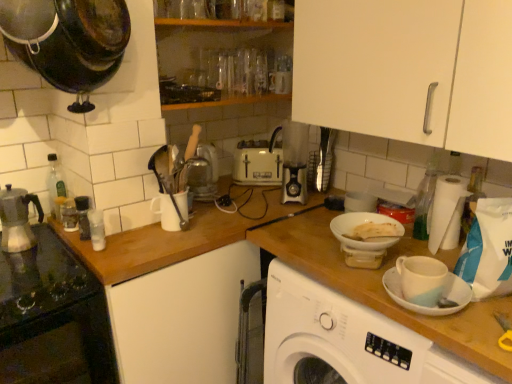
Question: Is clear plastic bottle at right, the 1th bottle from the right, in front of wooden at left?

Choices:
 (A) yes
 (B) no

Answer: (B)

Question: Can you confirm if clear plastic bottle at right, the 1th bottle from the right, is positioned to the left of wooden at left?

Choices:
 (A) yes
 (B) no

Answer: (B)

Question: Is clear plastic bottle at right, the 1th bottle from the right, directly adjacent to wooden at left?

Choices:
 (A) yes
 (B) no

Answer: (B)

Question: Can you confirm if clear plastic bottle at right, the 1th bottle from the right, is wider than wooden at left?

Choices:
 (A) yes
 (B) no

Answer: (B)

Question: Is clear plastic bottle at right, the 1th bottle from the right, thinner than wooden at left?

Choices:
 (A) no
 (B) yes

Answer: (B)

Question: Looking at their shapes, would you say black plastic grinder at left, placed as the 3th bottle when sorted from right to left, is wider or thinner than clear glass bottle at left, arranged as the 4th bottle when viewed from the right?

Choices:
 (A) wide
 (B) thin

Answer: (B)

Question: Is black plastic grinder at left, placed as the 3th bottle when sorted from right to left, in front of or behind clear glass bottle at left, which is counted as the first bottle, starting from the left, in the image?

Choices:
 (A) behind
 (B) front

Answer: (B)

Question: Considering the positions of black plastic grinder at left, positioned as the 2th bottle in left-to-right order, and clear glass bottle at left, which is counted as the first bottle, starting from the left, in the image, is black plastic grinder at left, positioned as the 2th bottle in left-to-right order, taller or shorter than clear glass bottle at left, which is counted as the first bottle, starting from the left,?

Choices:
 (A) tall
 (B) short

Answer: (B)

Question: From the image's perspective, is black plastic grinder at left, placed as the 3th bottle when sorted from right to left, above or below clear glass bottle at left, arranged as the 4th bottle when viewed from the right?

Choices:
 (A) above
 (B) below

Answer: (B)

Question: From a real-world perspective, relative to black plastic grinder at left, placed as the 3th bottle when sorted from right to left, is white matte cabinet at upper right vertically above or below?

Choices:
 (A) below
 (B) above

Answer: (B)

Question: Considering the positions of white matte cabinet at upper right and black plastic grinder at left, placed as the 3th bottle when sorted from right to left, in the image, is white matte cabinet at upper right bigger or smaller than black plastic grinder at left, placed as the 3th bottle when sorted from right to left,?

Choices:
 (A) small
 (B) big

Answer: (B)

Question: In the image, is white matte cabinet at upper right positioned in front of or behind black plastic grinder at left, positioned as the 2th bottle in left-to-right order?

Choices:
 (A) behind
 (B) front

Answer: (B)

Question: Visually, is white matte cabinet at upper right positioned to the left or to the right of black plastic grinder at left, positioned as the 2th bottle in left-to-right order?

Choices:
 (A) right
 (B) left

Answer: (A)

Question: From a real-world perspective, is black glass cooktop at left physically located above or below clear plastic bottle at right, which is the fourth bottle in left-to-right order?

Choices:
 (A) above
 (B) below

Answer: (B)

Question: Is black glass cooktop at left to the left or to the right of clear plastic bottle at right, the 1th bottle from the right, in the image?

Choices:
 (A) right
 (B) left

Answer: (B)